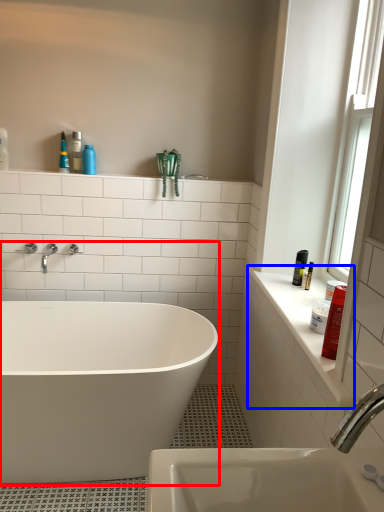
Question: Which of the following is the farthest to the observer, bathtub (highlighted by a red box) or counter top (highlighted by a blue box)?

Choices:
 (A) bathtub
 (B) counter top

Answer: (A)